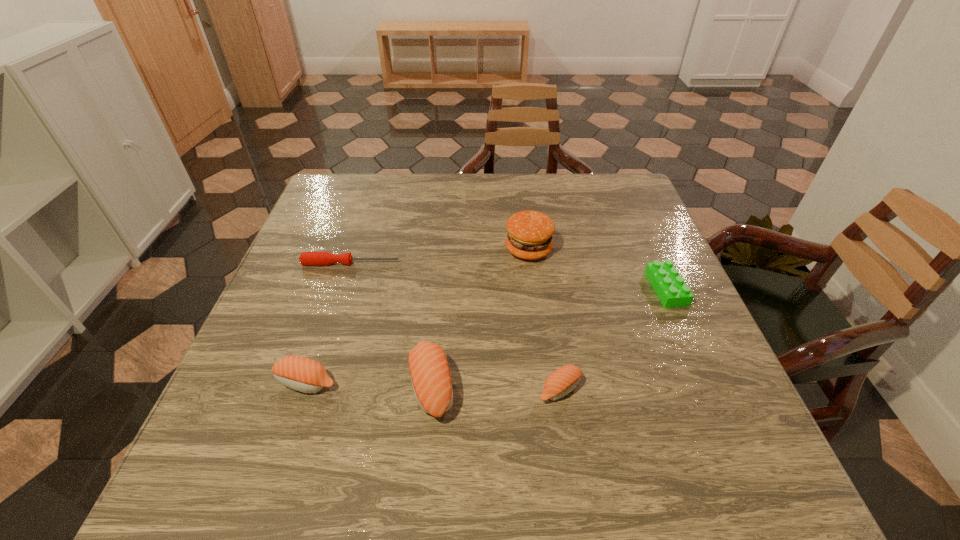
Locate an element on the screen. The height and width of the screenshot is (540, 960). free spot between the patty and the tallest sushi is located at coordinates (480, 318).

Identify the location of free space that is in between the fourth shortest object and the patty. (418, 316).

Find the location of a particular element. This screenshot has height=540, width=960. free space between the screwdriver and the third object from left to right is located at coordinates (392, 325).

Identify the location of free space that is in between the Lego and the leftmost sushi. [x=487, y=335].

Identify the location of vacant space that's between the shortest sushi and the patty. This screenshot has height=540, width=960. (544, 319).

Point out which object is positioned as the second nearest to the patty. Please provide its 2D coordinates. Your answer should be formatted as a tuple, i.e. [(x, y)], where the tuple contains the x and y coordinates of a point satisfying the conditions above.

[(306, 258)]

Identify which object is the nearest to the patty. Please provide its 2D coordinates. Your answer should be formatted as a tuple, i.e. [(x, y)], where the tuple contains the x and y coordinates of a point satisfying the conditions above.

[(670, 287)]

Identify which sushi is the third closest to the Lego. Please provide its 2D coordinates. Your answer should be formatted as a tuple, i.e. [(x, y)], where the tuple contains the x and y coordinates of a point satisfying the conditions above.

[(302, 374)]

Identify which sushi is the second nearest to the fourth nearest object. Please provide its 2D coordinates. Your answer should be formatted as a tuple, i.e. [(x, y)], where the tuple contains the x and y coordinates of a point satisfying the conditions above.

[(431, 379)]

You are a GUI agent. You are given a task and a screenshot of the screen. Output one action in this format:
    pyautogui.click(x=<x>, y=<y>)
    Task: Click on the free space that satisfies the following two spatial constraints: 1. on the back side of the rightmost sushi; 2. at the tip of the shortest object
    
    Given the screenshot: What is the action you would take?
    pyautogui.click(x=540, y=263)